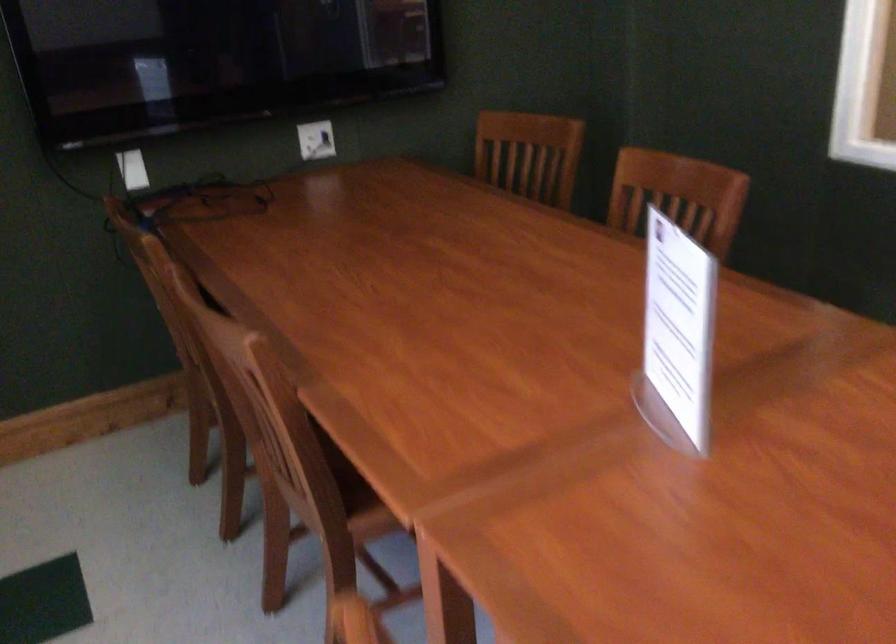
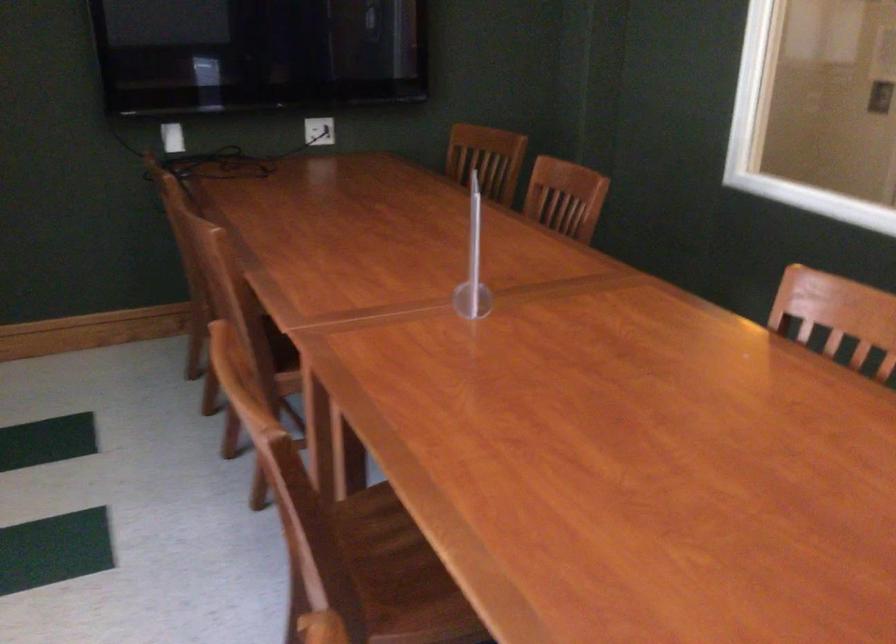
What movement of the cameraman would produce the second image?

The cameraman walked toward right, backward.